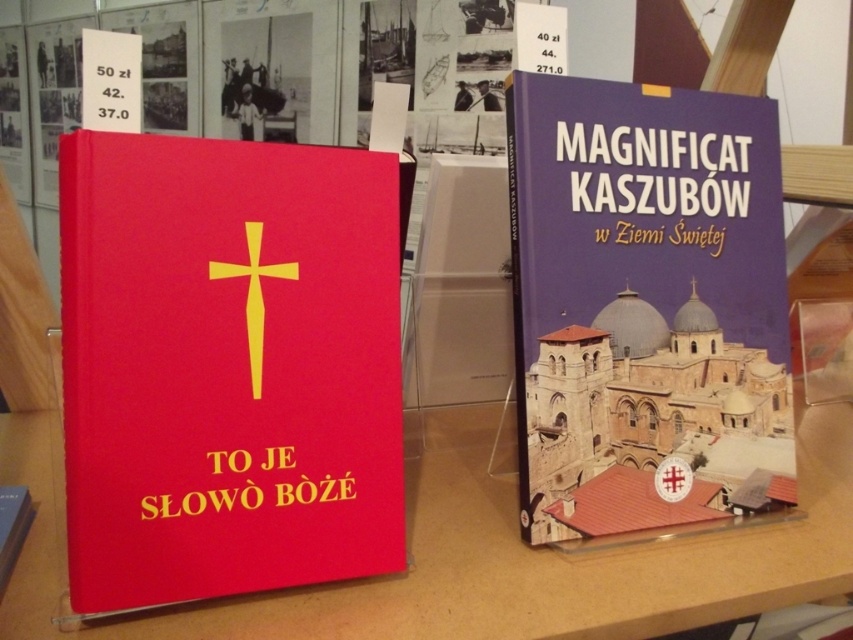
Does matte red book at left appear under yellow matte cross at center?

Yes.

Which is behind, point (706, 589) or point (228, 273)?

The point (706, 589) is more distant.

Identify the location of matte red book at left. (485, 557).

Which is above, matte red book at center or purple matte book at center?

purple matte book at center

Which of these two, matte red book at center or purple matte book at center, stands taller?

With more height is purple matte book at center.

Where is `matte red book at center`? The width and height of the screenshot is (853, 640). matte red book at center is located at coordinates (227, 365).

At what (x,y) coordinates should I click in order to perform the action: click on matte red book at center. Please return your answer as a coordinate pair (x, y). Image resolution: width=853 pixels, height=640 pixels. Looking at the image, I should click on (227, 365).

Who is positioned more to the right, purple matte book at center or yellow matte cross at center?

purple matte book at center is more to the right.

Is point (534, 369) in front of point (260, 291)?

That is False.

Image resolution: width=853 pixels, height=640 pixels. What do you see at coordinates (643, 304) in the screenshot? I see `purple matte book at center` at bounding box center [643, 304].

This screenshot has height=640, width=853. Identify the location of purple matte book at center. (643, 304).